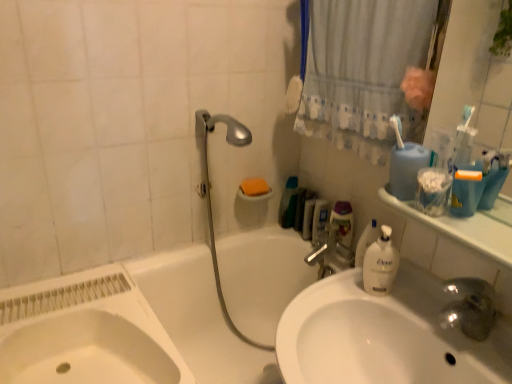
Find the location of a particular element. translucent plastic container at center is located at coordinates (343, 221).

This screenshot has width=512, height=384. What do you see at coordinates (210, 194) in the screenshot? I see `silver metallic shower head at upper center` at bounding box center [210, 194].

This screenshot has width=512, height=384. Describe the element at coordinates (254, 187) in the screenshot. I see `orange sponge at upper right` at that location.

Locate an element on the screen. blue plastic container at upper right, which appears as the 2th mouthwash when viewed from the back is located at coordinates (406, 169).

The image size is (512, 384). What are the coordinates of `translucent plastic container at center` in the screenshot? It's located at (343, 221).

Is orange matte cup at right, placed as the first mouthwash when sorted from front to back, closer to the viewer compared to white glossy sink at lower left, acting as the first sink starting from the left?

No.

Is orange matte cup at right, the third mouthwash in the back-to-front sequence, placed right next to white glossy sink at lower left, which is the 2th sink in right-to-left order?

No, orange matte cup at right, the third mouthwash in the back-to-front sequence, is not next to white glossy sink at lower left, which is the 2th sink in right-to-left order.

Which of these two, orange matte cup at right, which ranks as the third mouthwash in left-to-right order, or white glossy sink at lower left, acting as the first sink starting from the left, is bigger?

Bigger between the two is white glossy sink at lower left, acting as the first sink starting from the left.

Is white glossy sink at lower left, which is the 2th sink in right-to-left order, surrounded by orange matte cup at right, placed as the first mouthwash when sorted from front to back?

No, orange matte cup at right, placed as the first mouthwash when sorted from front to back, does not contain white glossy sink at lower left, which is the 2th sink in right-to-left order.

Considering the sizes of orange sponge at upper right and blue plastic container at upper right, the 2th mouthwash when ordered from front to back, in the image, is orange sponge at upper right taller or shorter than blue plastic container at upper right, the 2th mouthwash when ordered from front to back,?

In the image, orange sponge at upper right appears to be shorter than blue plastic container at upper right, the 2th mouthwash when ordered from front to back.

From a real-world perspective, between orange sponge at upper right and blue plastic container at upper right, which appears as the 2th mouthwash when viewed from the back, who is vertically higher?

From a 3D spatial view, blue plastic container at upper right, which appears as the 2th mouthwash when viewed from the back, is above.

At what (x,y) coordinates should I click in order to perform the action: click on mouthwash above the orange sponge at upper right (from the image's perspective). Please return your answer as a coordinate pair (x, y). Looking at the image, I should click on (406, 169).

Could you tell me if orange sponge at upper right is turned towards blue plastic container at upper right, which is counted as the 2th mouthwash, starting from the right?

No, orange sponge at upper right is not aimed at blue plastic container at upper right, which is counted as the 2th mouthwash, starting from the right.

Find the location of a particular element. This screenshot has width=512, height=384. cleaning product that appears below the orange matte cup at right, the third mouthwash in the back-to-front sequence (from the image's perspective) is located at coordinates (289, 203).

From the image's perspective, between translucent plastic bottle at upper right and orange matte cup at right, which ranks as the third mouthwash in left-to-right order, who is located below?

translucent plastic bottle at upper right.

Are translucent plastic bottle at upper right and orange matte cup at right, positioned as the 1th mouthwash in right-to-left order, beside each other?

No, translucent plastic bottle at upper right is not in contact with orange matte cup at right, positioned as the 1th mouthwash in right-to-left order.

Does translucent plastic bottle at upper right have a lesser width compared to orange matte cup at right, positioned as the 1th mouthwash in right-to-left order?

No, translucent plastic bottle at upper right is not thinner than orange matte cup at right, positioned as the 1th mouthwash in right-to-left order.

The width and height of the screenshot is (512, 384). In order to click on soap behind the white fabric shower curtain at upper right in this screenshot , I will do `click(254, 187)`.

Which of these two, orange sponge at upper right or white fabric shower curtain at upper right, is smaller?

orange sponge at upper right is smaller.

Consider the image. Is orange sponge at upper right to the right of white fabric shower curtain at upper right from the viewer's perspective?

In fact, orange sponge at upper right is to the left of white fabric shower curtain at upper right.

Is orange sponge at upper right directly adjacent to clear plastic mouthwash at upper right, which is the third mouthwash in right-to-left order?

They are not placed beside each other.

Is the depth of orange sponge at upper right greater than that of clear plastic mouthwash at upper right, arranged as the 1th mouthwash when viewed from the left?

No, orange sponge at upper right is in front of clear plastic mouthwash at upper right, arranged as the 1th mouthwash when viewed from the left.

Is point (251, 179) closer or farther from the camera than point (313, 241)?

Point (251, 179).

How different are the orientations of white glossy bathtub at center and white glossy sink at lower left, acting as the first sink starting from the left, in degrees?

1.11 degrees.

From the image's perspective, is white glossy bathtub at center on white glossy sink at lower left, acting as the first sink starting from the left?

No, from the image's perspective, white glossy bathtub at center is not above white glossy sink at lower left, acting as the first sink starting from the left.

Considering the relative positions of white glossy bathtub at center and white glossy sink at lower left, which is the 2th sink in right-to-left order, in the image provided, is white glossy bathtub at center to the left of white glossy sink at lower left, which is the 2th sink in right-to-left order, from the viewer's perspective?

No.

Is white glossy bathtub at center bigger or smaller than white glossy sink at lower left, which is the 2th sink in right-to-left order?

white glossy bathtub at center is bigger than white glossy sink at lower left, which is the 2th sink in right-to-left order.

Is clear plastic mouthwash at upper right, positioned as the 3th mouthwash in front-to-back order, completely or partially outside of white glossy bathtub at center?

Yes, clear plastic mouthwash at upper right, positioned as the 3th mouthwash in front-to-back order, is located beyond the bounds of white glossy bathtub at center.

How different are the orientations of clear plastic mouthwash at upper right, which is the third mouthwash in right-to-left order, and white glossy bathtub at center in degrees?

There is a 2.82-degree angle between the facing directions of clear plastic mouthwash at upper right, which is the third mouthwash in right-to-left order, and white glossy bathtub at center.

Is the surface of clear plastic mouthwash at upper right, positioned as the 3th mouthwash in front-to-back order, in direct contact with white glossy bathtub at center?

They are not placed beside each other.

Starting from the white glossy sink at lower left, acting as the first sink starting from the left, which mouthwash is the 3rd one to the right? Please provide its 2D coordinates.

[(467, 190)]

This screenshot has height=384, width=512. I want to click on soap to the left of blue plastic container at upper right, the 2th mouthwash when ordered from front to back, so click(254, 187).

When comparing their distances from clear plastic mouthwash at upper right, positioned as the 3th mouthwash in front-to-back order, does translucent plastic container at center or white glossy countertop at upper right seem closer?

translucent plastic container at center.

From the image, which object appears to be nearer to translucent plastic bottle at upper right, translucent plastic container at center or blue plastic container at upper right, arranged as the 2th mouthwash when viewed from the left?

translucent plastic container at center is closer to translucent plastic bottle at upper right.

Which object lies further to the anchor point silver metallic faucet at upper center, white glossy bathtub at center or clear plastic mouthwash at upper right, which is the third mouthwash in right-to-left order?

white glossy bathtub at center is further to silver metallic faucet at upper center.

Based on their spatial positions, is orange matte cup at right, the third mouthwash in the back-to-front sequence, or blue plastic container at upper right, which is counted as the 2th mouthwash, starting from the right, closer to clear plastic mouthwash at upper right, positioned as the 3th mouthwash in front-to-back order?

The object closer to clear plastic mouthwash at upper right, positioned as the 3th mouthwash in front-to-back order, is blue plastic container at upper right, which is counted as the 2th mouthwash, starting from the right.

Based on their spatial positions, is orange matte cup at right, positioned as the 1th mouthwash in right-to-left order, or silver metallic faucet at upper center further from clear plastic mouthwash at upper right, arranged as the 1th mouthwash when viewed from the left?

orange matte cup at right, positioned as the 1th mouthwash in right-to-left order, is positioned further to the anchor clear plastic mouthwash at upper right, arranged as the 1th mouthwash when viewed from the left.

Which object lies nearer to the anchor point clear plastic mouthwash at upper right, arranged as the 1th mouthwash when viewed from the left, translucent plastic container at center or white fabric shower curtain at upper right?

Based on the image, translucent plastic container at center appears to be nearer to clear plastic mouthwash at upper right, arranged as the 1th mouthwash when viewed from the left.

When comparing their distances from white glossy bathtub at center, does blue plastic container at upper right, the 2th mouthwash when ordered from front to back, or white glossy sink at lower left, acting as the first sink starting from the left, seem further?

blue plastic container at upper right, the 2th mouthwash when ordered from front to back, is positioned further to the anchor white glossy bathtub at center.

Looking at the image, which one is located further to translucent plastic container at center, white glossy bathtub at center or blue plastic container at upper right, arranged as the 2th mouthwash when viewed from the left?

blue plastic container at upper right, arranged as the 2th mouthwash when viewed from the left, is further to translucent plastic container at center.

This screenshot has width=512, height=384. I want to click on shower located between white glossy countertop at upper right and clear plastic mouthwash at upper right, which is the third mouthwash in right-to-left order, in the depth direction, so click(x=210, y=194).

Identify the location of shower curtain located between white glossy bathtub at center and translucent plastic bottle at upper right in the depth direction. Image resolution: width=512 pixels, height=384 pixels. (362, 70).

Where is `toiletry between white fabric shower curtain at upper right and clear plastic mouthwash at upper right, arranged as the 1th mouthwash when viewed from the left, from front to back`? This screenshot has width=512, height=384. toiletry between white fabric shower curtain at upper right and clear plastic mouthwash at upper right, arranged as the 1th mouthwash when viewed from the left, from front to back is located at coordinates (343, 221).

Find the location of a particular element. The width and height of the screenshot is (512, 384). plumbing fixture positioned between white glossy sink at lower left, acting as the first sink starting from the left, and translucent plastic bottle at upper right from near to far is located at coordinates (331, 256).